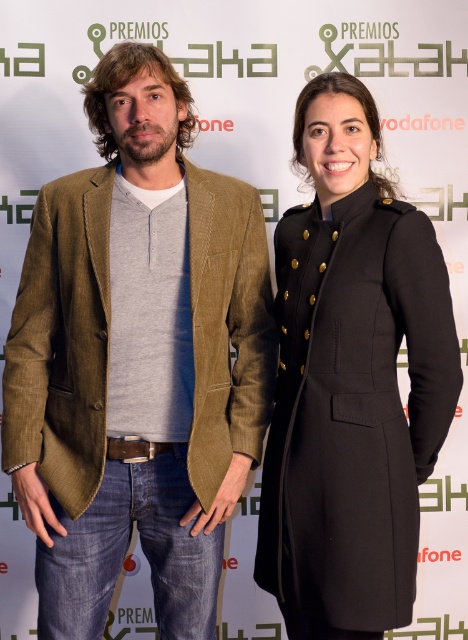
Who is positioned more to the right, black wool coat at center or brown leather belt at center?

From the viewer's perspective, black wool coat at center appears more on the right side.

Is black wool coat at center in front of brown leather belt at center?

Yes, black wool coat at center is in front of brown leather belt at center.

Is point (343, 372) behind point (137, 448)?

No, it is not.

Where is `black wool coat at center`? The image size is (468, 640). black wool coat at center is located at coordinates (351, 381).

Is point (168, 296) positioned in front of point (145, 456)?

Yes, it is in front of point (145, 456).

Who is more distant from viewer, (x=168, y=193) or (x=112, y=442)?

The point (x=168, y=193) is behind.

Identify the location of matte brown blazer at center. This screenshot has height=640, width=468. (137, 358).

In the scene shown: Which is above, matte brown blazer at center or black wool coat at center?

Positioned higher is matte brown blazer at center.

Measure the distance from matte brown blazer at center to black wool coat at center.

A distance of 11.80 inches exists between matte brown blazer at center and black wool coat at center.

Identify the location of matte brown blazer at center. (137, 358).